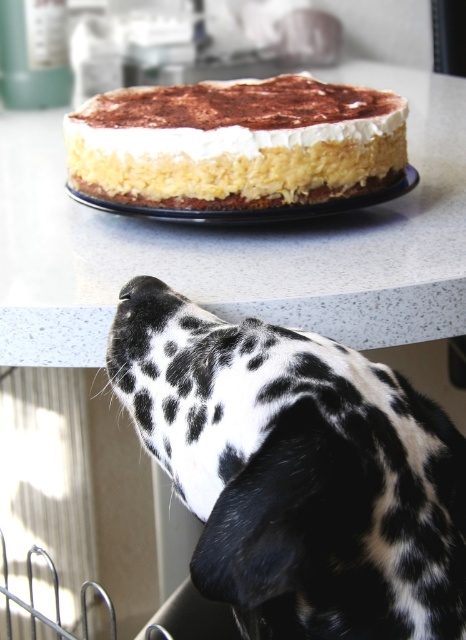
Is white creamy cake at center bigger than yellow sponge cake at center?

Correct, white creamy cake at center is larger in size than yellow sponge cake at center.

Is white creamy cake at center positioned behind yellow sponge cake at center?

No.

Describe the element at coordinates (237, 144) in the screenshot. I see `white creamy cake at center` at that location.

Find the location of a particular element. white creamy cake at center is located at coordinates (237, 144).

Who is lower down, black and white spotted fur at upper center or yellow sponge cake at center?

black and white spotted fur at upper center is below.

What do you see at coordinates (297, 472) in the screenshot? The height and width of the screenshot is (640, 466). I see `black and white spotted fur at upper center` at bounding box center [297, 472].

This screenshot has height=640, width=466. I want to click on black and white spotted fur at upper center, so click(x=297, y=472).

Locate an element on the screen. This screenshot has width=466, height=640. black and white spotted fur at upper center is located at coordinates (297, 472).

Can you confirm if black and white spotted fur at upper center is wider than white speckled table at center?

No.

Where is `black and white spotted fur at upper center`? black and white spotted fur at upper center is located at coordinates (297, 472).